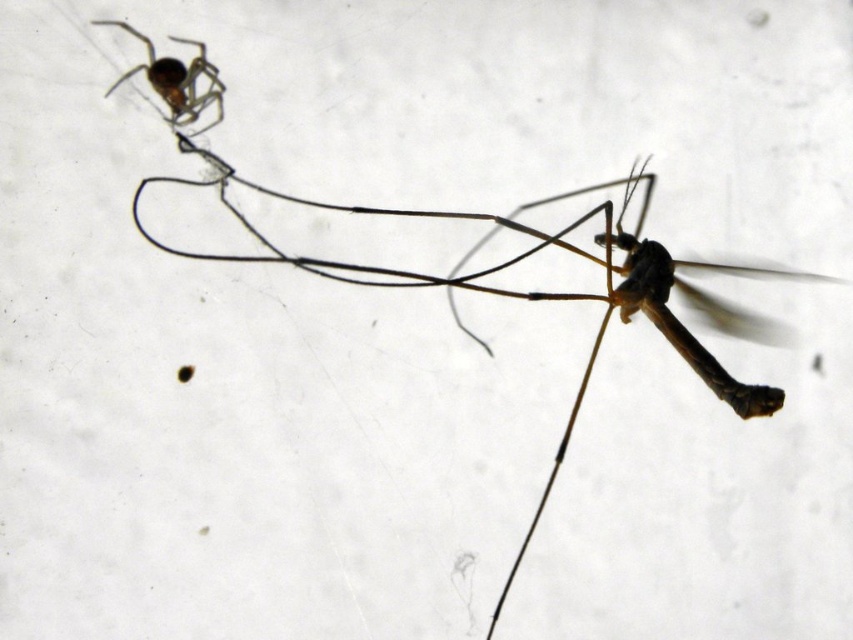
Question: Which point appears farthest from the camera in this image?

Choices:
 (A) [x=340, y=262]
 (B) [x=134, y=68]

Answer: (B)

Question: Among these points, which one is nearest to the camera?

Choices:
 (A) (744, 387)
 (B) (152, 83)

Answer: (A)

Question: Does matte black spider at upper left appear on the right side of shiny brown spider at upper left?

Choices:
 (A) yes
 (B) no

Answer: (A)

Question: Is matte black spider at upper left further to camera compared to shiny brown spider at upper left?

Choices:
 (A) no
 (B) yes

Answer: (A)

Question: Is matte black spider at upper left to the left of shiny brown spider at upper left from the viewer's perspective?

Choices:
 (A) no
 (B) yes

Answer: (A)

Question: Among these points, which one is farthest from the camera?

Choices:
 (A) (720, 301)
 (B) (112, 90)

Answer: (A)